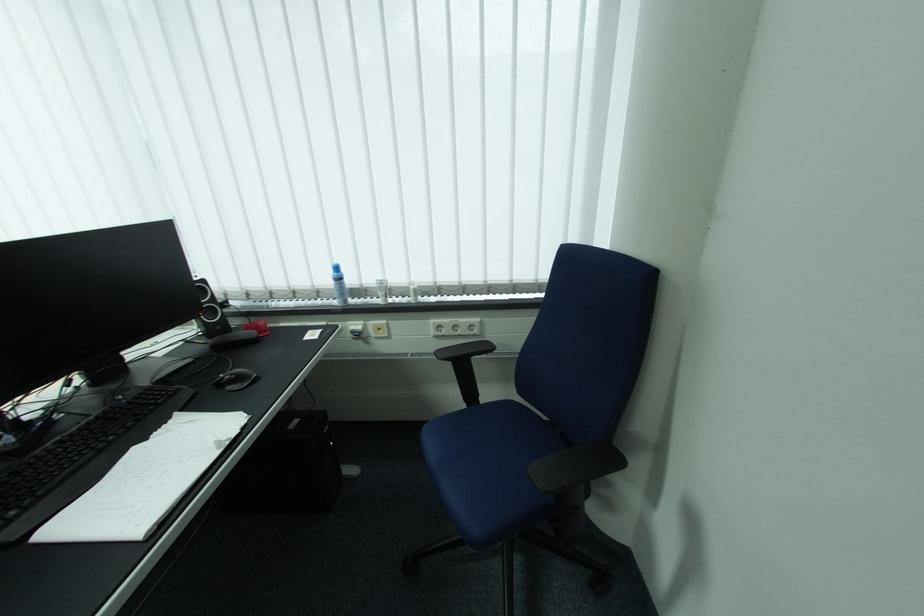
Describe the element at coordinates (489, 464) in the screenshot. The width and height of the screenshot is (924, 616). I see `a chair sitting surface` at that location.